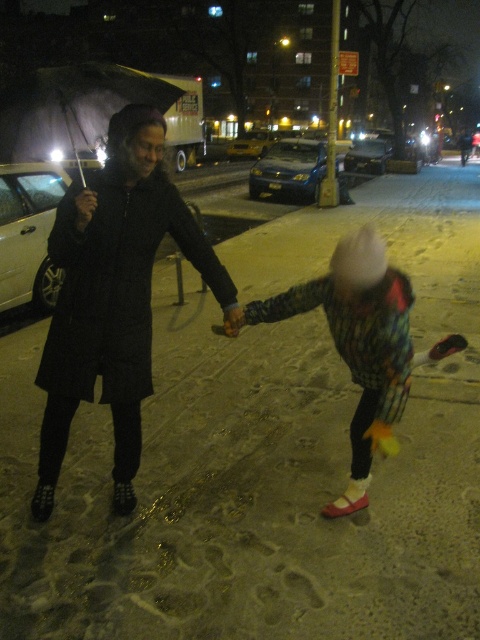
Question: Does transparent plastic umbrella at upper left have a lesser width compared to metallic blue sedan at center?

Choices:
 (A) no
 (B) yes

Answer: (A)

Question: Which object appears farthest from the camera in this image?

Choices:
 (A) blue metallic hatchback at center
 (B) white matte car at left

Answer: (A)

Question: Which point is closer to the camera?

Choices:
 (A) yellow matte taxi cab at center
 (B) black textured coat at left
 (C) transparent plastic umbrella at upper left
 (D) white matte car at left

Answer: (B)

Question: Is transparent plastic umbrella at upper left smaller than metallic blue sedan at center?

Choices:
 (A) yes
 (B) no

Answer: (B)

Question: Which point is closer to the camera?

Choices:
 (A) white matte car at left
 (B) fluffy knit hat at lower right

Answer: (B)

Question: In this image, where is fluffy knit hat at lower right located relative to blue metallic hatchback at center?

Choices:
 (A) left
 (B) right

Answer: (A)